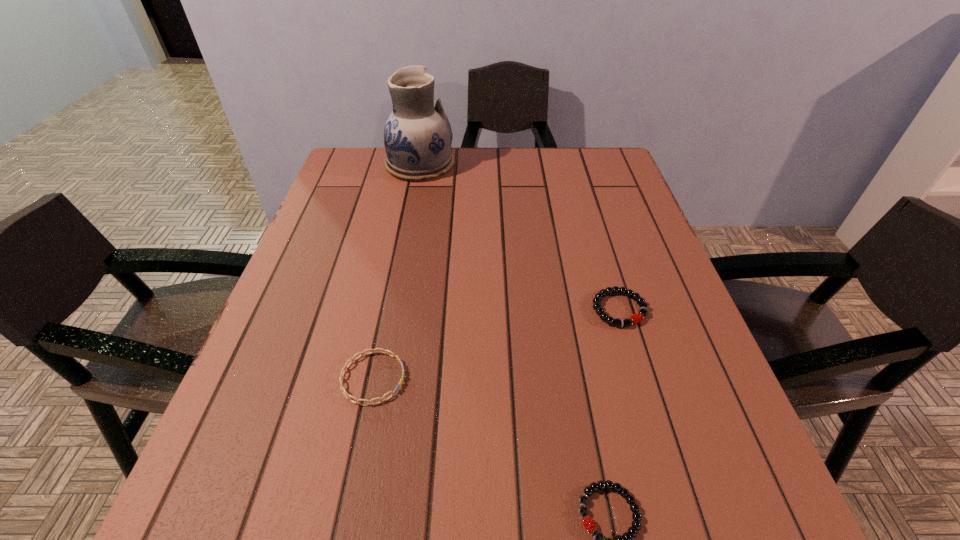
You are a GUI agent. You are given a task and a screenshot of the screen. Output one action in this format:
    pyautogui.click(x=<x>, y=<y>)
    Task: Click on the object that is at the left edge
    The width and height of the screenshot is (960, 540).
    Given the screenshot: What is the action you would take?
    pyautogui.click(x=417, y=136)

What are the coordinates of `object positioned at the right edge` in the screenshot? It's located at (636, 318).

Locate an element on the screen. This screenshot has height=540, width=960. object that is at the far left corner is located at coordinates (417, 136).

The height and width of the screenshot is (540, 960). Identify the location of free space at the far edge of the desktop. (520, 147).

The width and height of the screenshot is (960, 540). I want to click on vacant space at the near edge, so click(x=450, y=505).

In order to click on vacant space at the left edge of the desktop in this screenshot , I will do `click(276, 351)`.

At what (x,y) coordinates should I click in order to perform the action: click on vacant space at the right edge. Please return your answer as a coordinate pair (x, y). Image resolution: width=960 pixels, height=540 pixels. Looking at the image, I should click on (604, 197).

The height and width of the screenshot is (540, 960). I want to click on vacant area at the far left corner, so click(x=375, y=150).

Where is `vacant region at the far right corner of the desktop`? The image size is (960, 540). vacant region at the far right corner of the desktop is located at coordinates (583, 150).

Locate an element on the screen. The height and width of the screenshot is (540, 960). vacant space that's between the third nearest object and the pottery is located at coordinates coord(519,237).